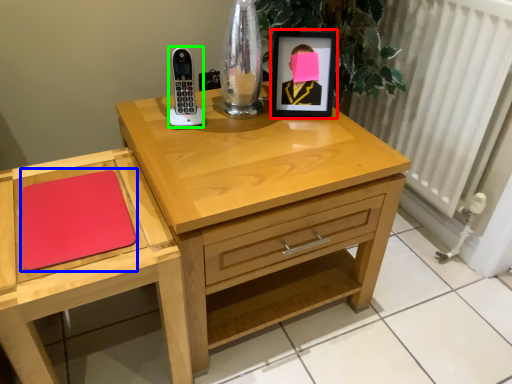
Question: Based on their relative distances, which object is farther from picture frame (highlighted by a red box)? Choose from notepad (highlighted by a blue box) and phone (highlighted by a green box).

Choices:
 (A) notepad
 (B) phone

Answer: (A)